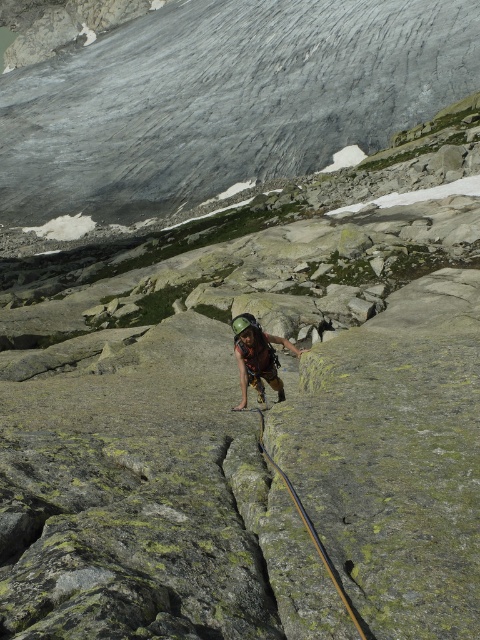
Is point (177, 90) positioned behind point (273, 461)?

Yes, point (177, 90) is farther from viewer.

What do you see at coordinates (223, 99) in the screenshot? I see `gray rock at center` at bounding box center [223, 99].

Between point (175, 20) and point (300, 513), which one is positioned in front?

Point (300, 513) is more forward.

Identify the location of gray rock at center. This screenshot has height=640, width=480. (223, 99).

Can you confirm if gray rock at center is positioned above matte brown helmet at center?

Yes, gray rock at center is above matte brown helmet at center.

Who is more forward, [385,115] or [271,380]?

Point [271,380] is more forward.

Find the location of a particular element. The image size is (480, 640). gray rock at center is located at coordinates (223, 99).

Can you confirm if matte brown helmet at center is taller than black rubber rope at center?

Yes.

In order to click on matte brown helmet at center in this screenshot , I will do `click(256, 356)`.